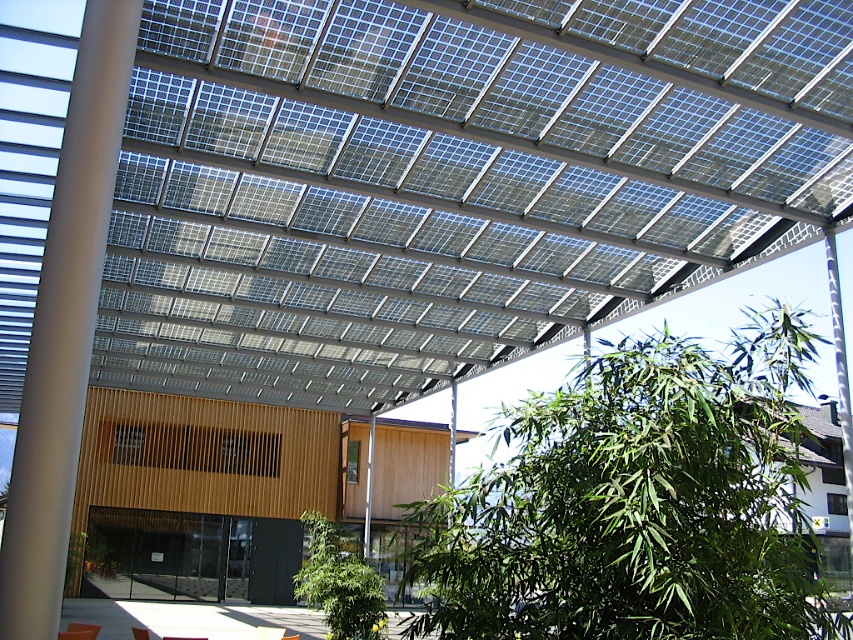
You are standing in front of the building and notice the white smooth pillar at left and the green leafy plant at center. Which object is positioned to the right of the other?

The white smooth pillar at left is to the right of the green leafy plant at center.

You are standing at the entrance of the building and want to reach the point marked at coordinates point (786, 140) and point (453, 632). Which point is closer to you?

Point (453, 632) is closer to you because it is in front of point (786, 140), which is behind it.